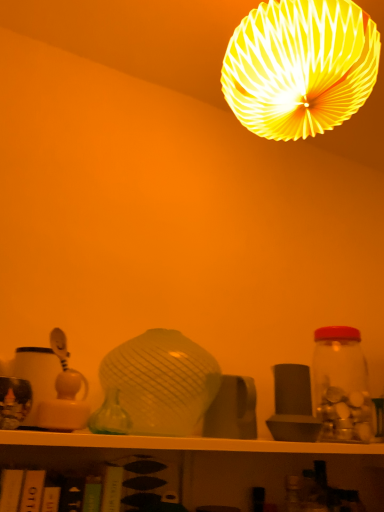
I want to click on yellow paper lampshade at upper center, so click(x=300, y=67).

This screenshot has height=512, width=384. I want to click on yellow paper lampshade at upper center, so click(300, 67).

Does point (108, 407) lie behind point (42, 402)?

That is True.

Considering the relative sizes of green glass vase at center and matte yellow plastic toy at left in the image provided, is green glass vase at center smaller than matte yellow plastic toy at left?

Indeed, green glass vase at center has a smaller size compared to matte yellow plastic toy at left.

Is green glass vase at center oriented towards matte yellow plastic toy at left?

No, green glass vase at center is not aimed at matte yellow plastic toy at left.

Relative to matte yellow plastic toy at left, is green glass vase at center in front or behind?

In the image, green glass vase at center appears behind matte yellow plastic toy at left.

From a real-world perspective, which object rests below the other?

In real-world perspective, matte yellow plastic toy at left is lower.

From the image's perspective, which one is positioned higher, transparent glass jar at right or matte yellow plastic toy at left?

matte yellow plastic toy at left appears higher in the image.

Would you say matte yellow plastic toy at left is part of transparent glass jar at right's contents?

Actually, matte yellow plastic toy at left is outside transparent glass jar at right.

In the image, is transparent glass jar at right positioned in front of or behind matte yellow plastic toy at left?

Visually, transparent glass jar at right is located behind matte yellow plastic toy at left.

Is green glass vase at center touching transparent glass jar at right?

They are not placed beside each other.

Is green glass vase at center oriented towards transparent glass jar at right?

No, green glass vase at center is not turned towards transparent glass jar at right.

In the image, is green glass vase at center on the left side or the right side of transparent glass jar at right?

From the image, it's evident that green glass vase at center is to the left of transparent glass jar at right.

Is green glass vase at center located outside transparent glass jar at right?

Yes, green glass vase at center is outside of transparent glass jar at right.

This screenshot has width=384, height=512. I want to click on glass jar lying below the yellow paper lampshade at upper center (from the image's perspective), so click(x=341, y=385).

Is transparent glass jar at right located outside yellow paper lampshade at upper center?

Yes, transparent glass jar at right is not within yellow paper lampshade at upper center.

From a real-world perspective, is transparent glass jar at right located beneath yellow paper lampshade at upper center?

Yes, from a real-world perspective, transparent glass jar at right is under yellow paper lampshade at upper center.

Is matte yellow plastic toy at left positioned beyond the bounds of transparent glass jar at right?

That's correct, matte yellow plastic toy at left is outside of transparent glass jar at right.

From a real-world perspective, is matte yellow plastic toy at left physically below transparent glass jar at right?

Yes.

Is matte yellow plastic toy at left looking in the opposite direction of transparent glass jar at right?

matte yellow plastic toy at left is not turned away from transparent glass jar at right.

Is the depth of matte yellow plastic toy at left greater than that of transparent glass jar at right?

No.

Relative to matte yellow plastic toy at left, is yellow paper lampshade at upper center in front or behind?

In the image, yellow paper lampshade at upper center appears in front of matte yellow plastic toy at left.

How many degrees apart are the facing directions of yellow paper lampshade at upper center and matte yellow plastic toy at left?

They differ by 2.08 degrees in their facing directions.

How distant is yellow paper lampshade at upper center from matte yellow plastic toy at left?

28.27 inches.

The height and width of the screenshot is (512, 384). What are the coordinates of `toy below the yellow paper lampshade at upper center (from the image's perspective)` in the screenshot? It's located at pyautogui.click(x=64, y=393).

Is matte yellow plastic toy at left oriented away from yellow paper lampshade at upper center?

matte yellow plastic toy at left is not turned away from yellow paper lampshade at upper center.

Where is `lamp in front of the matte yellow plastic toy at left`? Image resolution: width=384 pixels, height=512 pixels. lamp in front of the matte yellow plastic toy at left is located at coordinates (300, 67).

How different are the orientations of matte yellow plastic toy at left and yellow paper lampshade at upper center in degrees?

There is a 2.08-degree angle between the facing directions of matte yellow plastic toy at left and yellow paper lampshade at upper center.

Is matte yellow plastic toy at left at the left side of yellow paper lampshade at upper center?

Correct, you'll find matte yellow plastic toy at left to the left of yellow paper lampshade at upper center.

Where is `glass vase behind the matte yellow plastic toy at left`? This screenshot has height=512, width=384. glass vase behind the matte yellow plastic toy at left is located at coordinates click(110, 416).

In order to click on toy below the transparent glass jar at right (from a real-world perspective) in this screenshot , I will do `click(64, 393)`.

Looking at the image, which one is located closer to transparent glass jar at right, matte yellow plastic toy at left or yellow paper lampshade at upper center?

Based on the image, yellow paper lampshade at upper center appears to be nearer to transparent glass jar at right.

From the image, which object appears to be farther from transparent glass jar at right, green glass vase at center or matte yellow plastic toy at left?

Among the two, matte yellow plastic toy at left is located further to transparent glass jar at right.

Looking at the image, which one is located further to matte yellow plastic toy at left, yellow paper lampshade at upper center or green glass vase at center?

yellow paper lampshade at upper center lies further to matte yellow plastic toy at left than the other object.

Based on their spatial positions, is green glass vase at center or yellow paper lampshade at upper center further from matte yellow plastic toy at left?

yellow paper lampshade at upper center.

From the image, which object appears to be farther from yellow paper lampshade at upper center, matte yellow plastic toy at left or transparent glass jar at right?

matte yellow plastic toy at left lies further to yellow paper lampshade at upper center than the other object.

Considering their positions, is transparent glass jar at right positioned closer to green glass vase at center than yellow paper lampshade at upper center?

Among the two, transparent glass jar at right is located nearer to green glass vase at center.

Which object lies further to the anchor point yellow paper lampshade at upper center, transparent glass jar at right or matte yellow plastic toy at left?

matte yellow plastic toy at left lies further to yellow paper lampshade at upper center than the other object.

Based on the photo, from the image, which object appears to be nearer to yellow paper lampshade at upper center, transparent glass jar at right or green glass vase at center?

Based on the image, transparent glass jar at right appears to be nearer to yellow paper lampshade at upper center.

Find the location of `toy between yellow paper lampshade at upper center and green glass vase at center in the vertical direction`. toy between yellow paper lampshade at upper center and green glass vase at center in the vertical direction is located at coordinates (64, 393).

Image resolution: width=384 pixels, height=512 pixels. Find the location of `toy between yellow paper lampshade at upper center and transparent glass jar at right vertically`. toy between yellow paper lampshade at upper center and transparent glass jar at right vertically is located at coordinates (64, 393).

You are a GUI agent. You are given a task and a screenshot of the screen. Output one action in this format:
    pyautogui.click(x=<x>, y=<y>)
    Task: Click on the glass vase between yellow paper lampshade at upper center and transparent glass jar at right in the vertical direction
    This screenshot has width=384, height=512.
    Given the screenshot: What is the action you would take?
    pyautogui.click(x=110, y=416)

Identify the location of glass vase situated between matte yellow plastic toy at left and transparent glass jar at right from left to right. (110, 416).